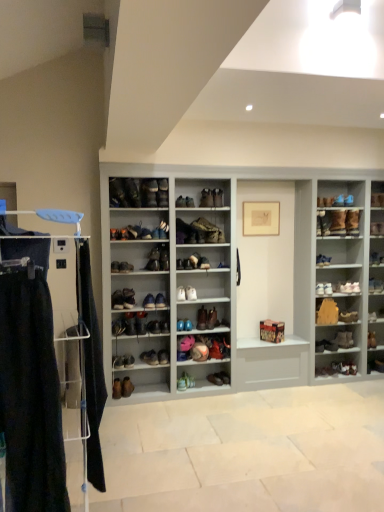
Question: Based on their sizes in the image, would you say leather shoe at center, the 19th shoe when ordered from right to left, is bigger or smaller than shiny leather sneaker at center, which is the 21th shoe in right-to-left order?

Choices:
 (A) small
 (B) big

Answer: (A)

Question: Is leather shoe at center, the 7th shoe from the left, in front of or behind shiny leather sneaker at center, which appears as the fifth shoe when viewed from the left, in the image?

Choices:
 (A) front
 (B) behind

Answer: (B)

Question: Estimate the real-world distances between objects in this image. Which object is closer to the brown suede shoe at lower right, the 22th shoe in the left-to-right sequence?

Choices:
 (A) shiny brown shoe at lower right, arranged as the first shoe when viewed from the right
 (B) leather boot at center, the 8th shoe when ordered from right to left
 (C) matte brown shoe at center, which ranks as the 1th shoe in left-to-right order
 (D) shiny leather sneaker at center, which is the 21th shoe in right-to-left order
 (E) leather shoe at center, which is the 24th shoe from right to left

Answer: (A)

Question: Which of these objects is positioned closest to the white leather shoe at upper right, marked as the second shoe in a right-to-left arrangement?

Choices:
 (A) matte brown shoe at center, the 13th shoe viewed from the left
 (B) leather boot at center, the 8th shoe when ordered from right to left
 (C) matte brown shoe at center, which is the third footwear from bottom to top
 (D) leather boot at center, acting as the 17th shoe starting from the left
 (E) leather shoe at center, the 7th shoe from the left

Answer: (D)